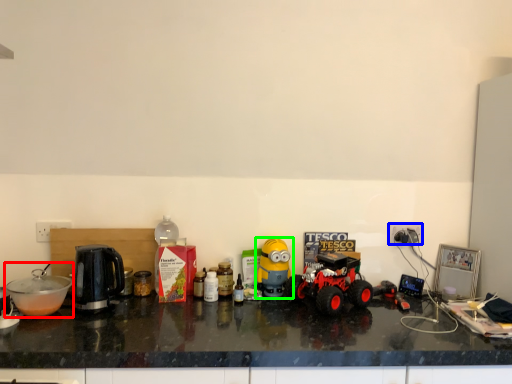
Question: Based on their relative distances, which object is farther from appliance (highlighted by a red box)? Choose from power outlet (highlighted by a blue box) and toy (highlighted by a green box).

Choices:
 (A) power outlet
 (B) toy

Answer: (A)